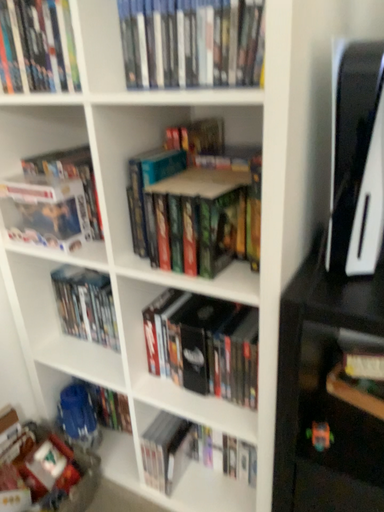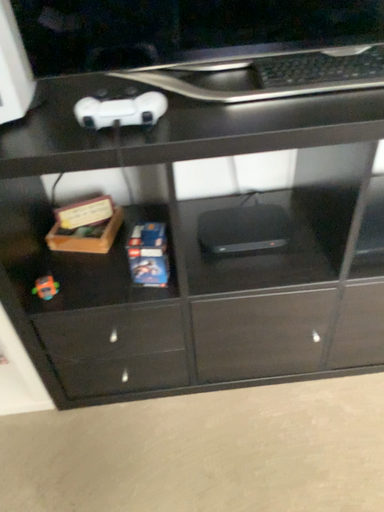
Question: How did the camera likely rotate when shooting the video?

Choices:
 (A) rotated left
 (B) rotated right

Answer: (B)